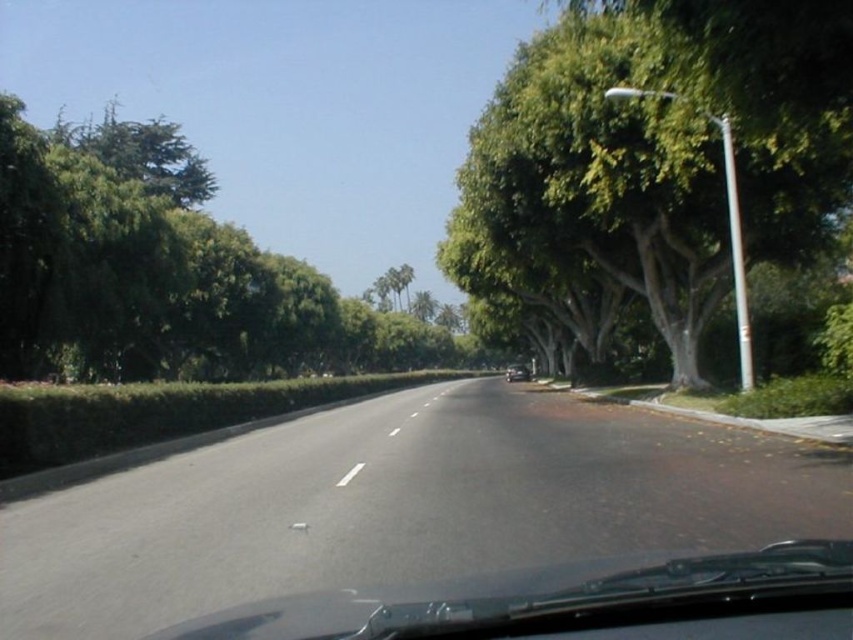
Which is above, green leafy tree at right or green leafy tree at left?

green leafy tree at right is above.

Does green leafy tree at right have a greater height compared to green leafy tree at left?

In fact, green leafy tree at right may be shorter than green leafy tree at left.

Is point (790, 211) less distant than point (172, 300)?

Yes, it is.

I want to click on green leafy tree at right, so click(x=659, y=156).

Can you confirm if green leafy tree at right is thinner than white glossy line at center?

In fact, green leafy tree at right might be wider than white glossy line at center.

At what (x,y) coordinates should I click in order to perform the action: click on green leafy tree at right. Please return your answer as a coordinate pair (x, y). Looking at the image, I should click on coord(659,156).

Which is more to the left, green leafy tree at left or white glossy line at center?

Positioned to the left is green leafy tree at left.

From the picture: Does green leafy tree at left have a smaller size compared to white glossy line at center?

Incorrect, green leafy tree at left is not smaller in size than white glossy line at center.

Is point (18, 368) less distant than point (337, 483)?

No, it is behind (337, 483).

Where is `green leafy tree at left`? green leafy tree at left is located at coordinates (157, 275).